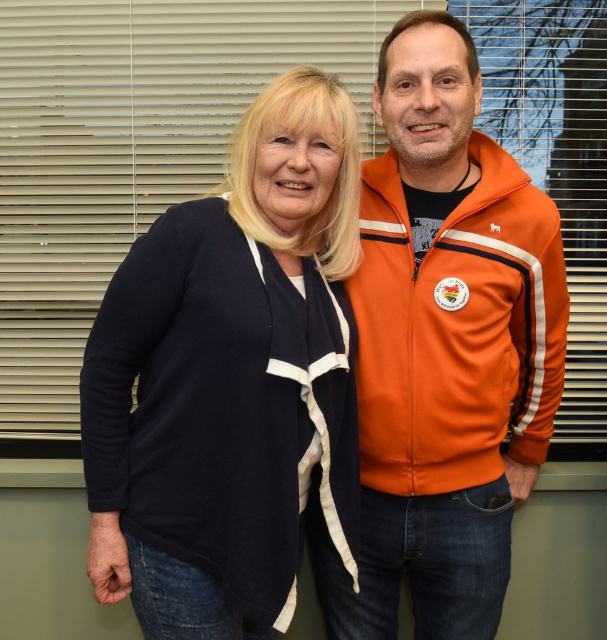
Who is lower down, navy blue sweater at center or matte plastic blinds at upper center?

Positioned lower is navy blue sweater at center.

Can you confirm if navy blue sweater at center is positioned to the right of matte plastic blinds at upper center?

In fact, navy blue sweater at center is to the left of matte plastic blinds at upper center.

Who is more forward, (x=354, y=120) or (x=47, y=124)?

Point (x=354, y=120) is in front.

I want to click on navy blue sweater at center, so click(x=231, y=380).

Does point (22, 321) come closer to viewer compared to point (446, 285)?

No, (22, 321) is behind (446, 285).

Image resolution: width=607 pixels, height=640 pixels. Identify the location of matte plastic blinds at upper center. (129, 148).

Locate an element on the screen. This screenshot has height=640, width=607. matte plastic blinds at upper center is located at coordinates (129, 148).

Which is above, navy blue sweater at center or orange fleece jacket at center?

Positioned higher is orange fleece jacket at center.

Is navy blue sweater at center positioned behind orange fleece jacket at center?

No.

Between point (214, 515) and point (387, 289), which one is positioned in front?

Point (214, 515)

Where is `navy blue sweater at center`? The image size is (607, 640). navy blue sweater at center is located at coordinates (231, 380).